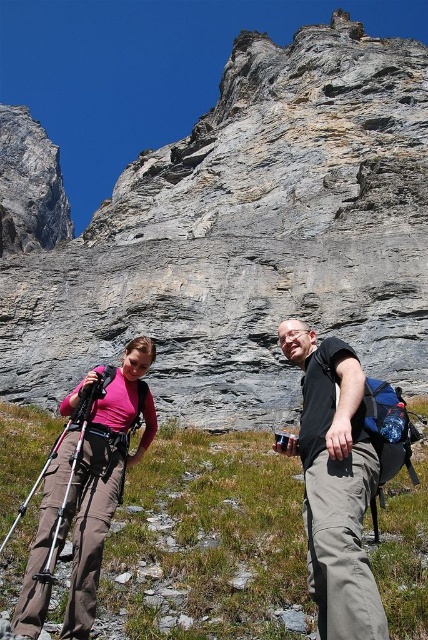
You are a drone operator tasked with capturing aerial footage of the green grassy area at the center of the mountain scene. Your drone has a maximum flight range of 35 meters. Can your drone reach the green grassy at center from your current position without exceeding its range limit?

The distance between the green grassy at center and the camera is 33.15 meters, which is within the drone operator maximum flight range of 35 meters. Yes, the drone can reach the green grassy at center without exceeding its range limit.

You are a hiker trying to locate the matte pink shirt at lower left and the green grassy at center in the image. Which object is positioned more to the left?

The matte pink shirt at lower left is positioned more to the left than the green grassy at center.